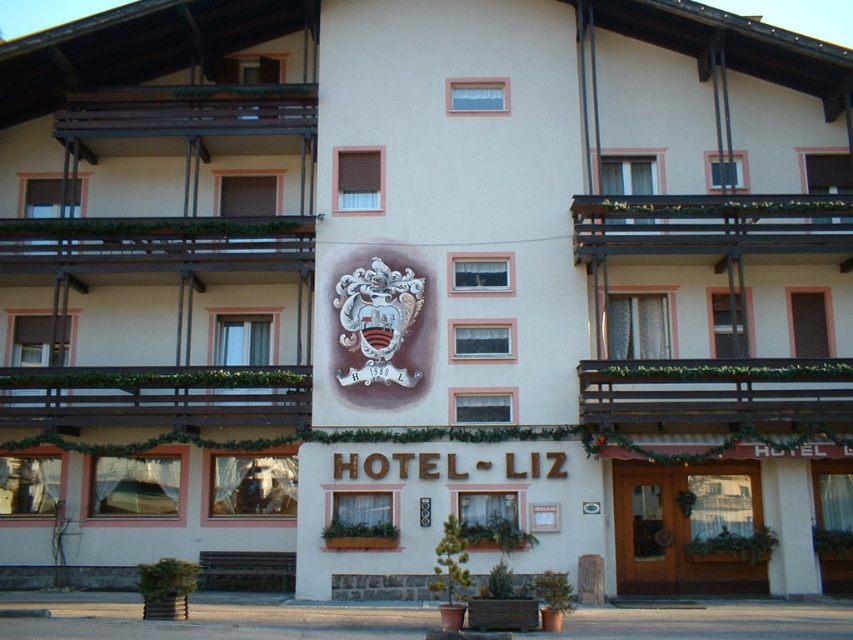
What are the coordinates of the white stucco building at center?

The white stucco building at center is located at coordinates point (155, 280).

You are standing at the entrance of the white stucco building at center and want to hang a wreath exactly 2 meters above the silver metallic coat of arms at center. Is there enough space between the coat of arms and the building edge to do this?

The white stucco building at center is 4.18 meters from the silver metallic coat of arms at center. Since you want to hang the wreath 2 meters above the coat of arms, there is sufficient space between the coat of arms and the building edge because 4.18 meters minus 2 meters leaves 2.18 meters of clearance.